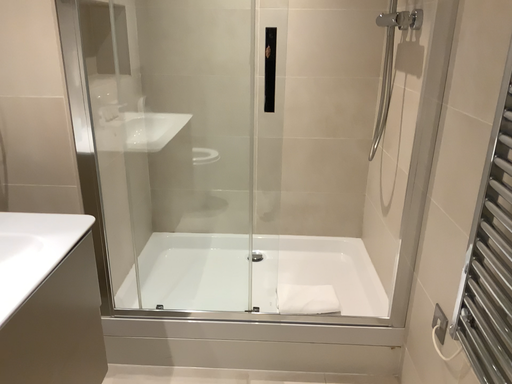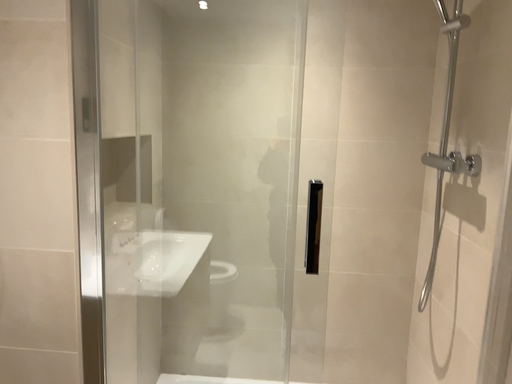
Question: How did the camera likely rotate when shooting the video?

Choices:
 (A) rotated downward
 (B) rotated upward

Answer: (B)